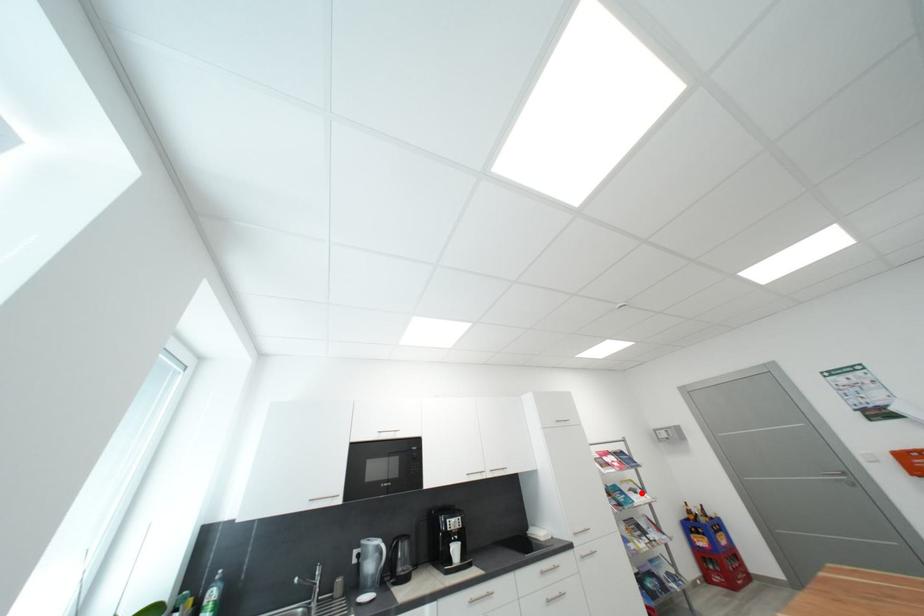
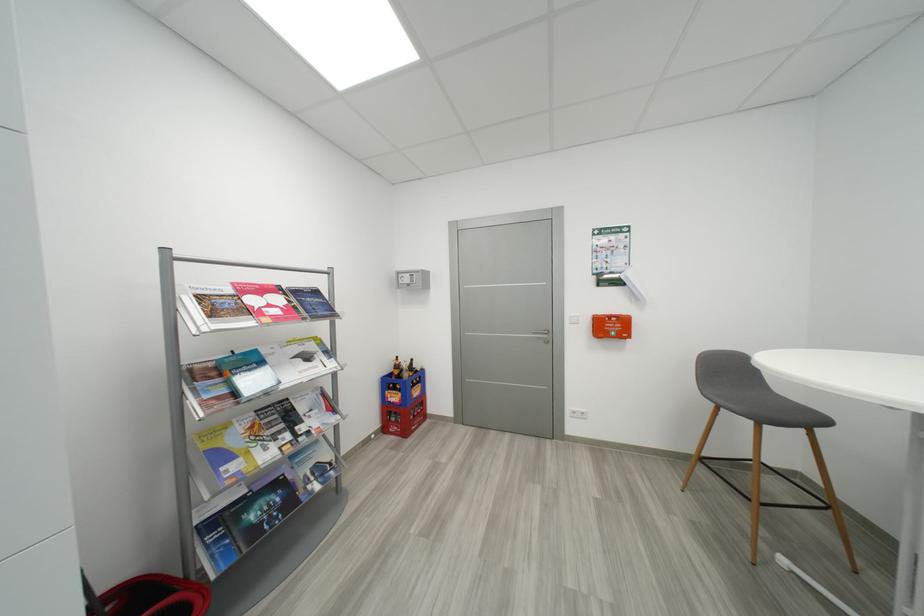
The point at the highlighted location is marked in the first image. Where is the corresponding point in the second image?

(314, 359)